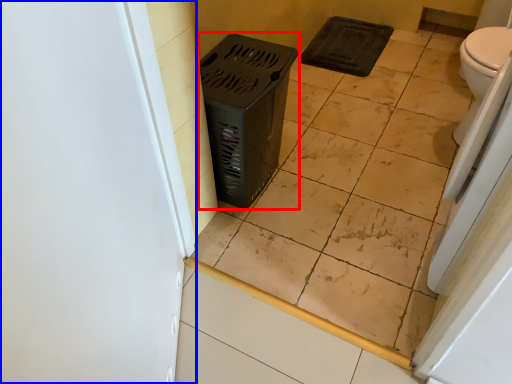
Question: Which object is closer to the camera taking this photo, laundry basket (highlighted by a red box) or screen door (highlighted by a blue box)?

Choices:
 (A) laundry basket
 (B) screen door

Answer: (B)